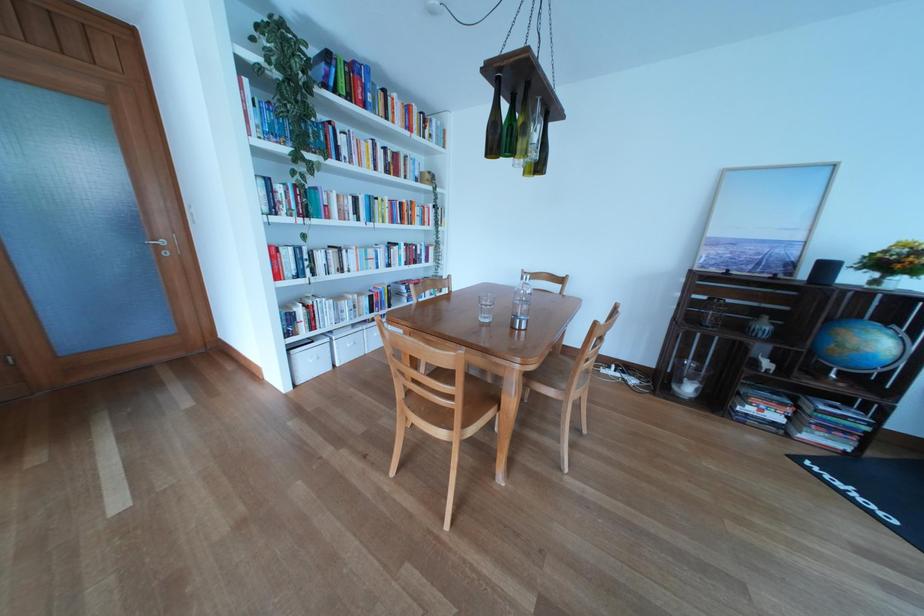
Where is `black speaker`? The image size is (924, 616). black speaker is located at coordinates (823, 272).